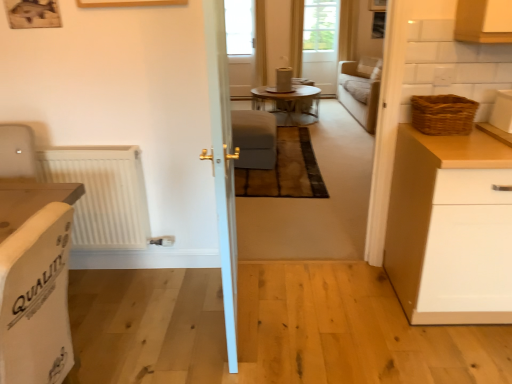
Question: Is white glossy container at upper right, acting as the 1th appliance starting from the front, not within white glossy door at center?

Choices:
 (A) yes
 (B) no

Answer: (A)

Question: Does white glossy container at upper right, which is the 2th appliance in left-to-right order, lie behind white glossy door at center?

Choices:
 (A) no
 (B) yes

Answer: (B)

Question: Is white glossy container at upper right, positioned as the first appliance in right-to-left order, oriented away from white glossy door at center?

Choices:
 (A) no
 (B) yes

Answer: (A)

Question: Can you confirm if white glossy container at upper right, which is the 2th appliance in left-to-right order, is positioned to the left of white glossy door at center?

Choices:
 (A) no
 (B) yes

Answer: (A)

Question: From the image's perspective, would you say white glossy container at upper right, positioned as the second appliance in back-to-front order, is shown under white glossy door at center?

Choices:
 (A) no
 (B) yes

Answer: (A)

Question: Can you confirm if white glossy container at upper right, positioned as the first appliance in right-to-left order, is smaller than white glossy door at center?

Choices:
 (A) no
 (B) yes

Answer: (B)

Question: Considering the relative positions of white matte cabinet at right and white fabric armchair at left, the 1th armchair when ordered from left to right, in the image provided, is white matte cabinet at right to the right of white fabric armchair at left, the 1th armchair when ordered from left to right, from the viewer's perspective?

Choices:
 (A) yes
 (B) no

Answer: (A)

Question: Considering the relative sizes of white matte cabinet at right and white fabric armchair at left, the second armchair when ordered from top to bottom, in the image provided, is white matte cabinet at right taller than white fabric armchair at left, the second armchair when ordered from top to bottom,?

Choices:
 (A) no
 (B) yes

Answer: (B)

Question: Is white matte cabinet at right positioned far away from white fabric armchair at left, which ranks as the first armchair in bottom-to-top order?

Choices:
 (A) yes
 (B) no

Answer: (A)

Question: Could you tell me if white matte cabinet at right is facing white fabric armchair at left, which is the first armchair from front to back?

Choices:
 (A) yes
 (B) no

Answer: (B)

Question: From a real-world perspective, is white matte cabinet at right over white fabric armchair at left, the second armchair when ordered from top to bottom?

Choices:
 (A) no
 (B) yes

Answer: (A)

Question: Considering the relative sizes of white matte cabinet at right and white fabric armchair at left, which is the second armchair in back-to-front order, in the image provided, is white matte cabinet at right wider than white fabric armchair at left, which is the second armchair in back-to-front order,?

Choices:
 (A) yes
 (B) no

Answer: (A)

Question: Considering the relative positions of transparent glass window at center and woven brown basket at right in the image provided, is transparent glass window at center behind woven brown basket at right?

Choices:
 (A) yes
 (B) no

Answer: (A)